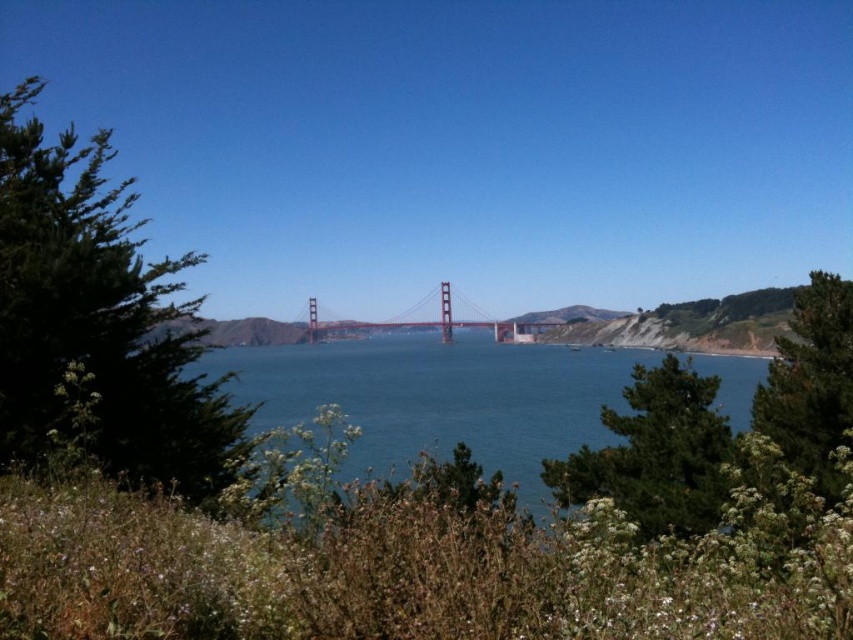
Question: Among these objects, which one is nearest to the camera?

Choices:
 (A) green leafy tree at left
 (B) painted steel bridge at center
 (C) green leafy tree at right

Answer: (A)

Question: Where is green leafy tree at left located in relation to painted steel bridge at center in the image?

Choices:
 (A) below
 (B) above

Answer: (A)

Question: Estimate the real-world distances between objects in this image. Which object is closer to the green leafy tree at left?

Choices:
 (A) green leafy tree at center
 (B) painted steel bridge at center
 (C) green leafy tree at right
 (D) blue water at center

Answer: (A)

Question: Which point is closer to the camera taking this photo?

Choices:
 (A) (354, 324)
 (B) (659, 372)
 (C) (809, 384)
 (D) (457, 384)

Answer: (C)

Question: Can you confirm if green leafy tree at left is positioned to the left of blue water at center?

Choices:
 (A) yes
 (B) no

Answer: (A)

Question: Is green leafy tree at center in front of green leafy tree at right?

Choices:
 (A) yes
 (B) no

Answer: (B)